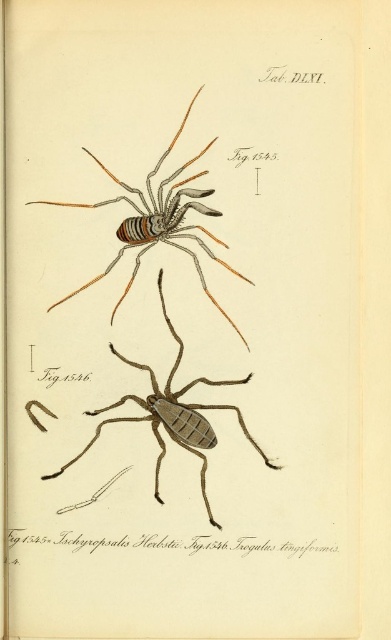
You are a researcher examining the illustration. You need to measure the distance between the matte striped spider at upper center and the edge of the page. The ruler you have is 3 feet long. Do you think you can measure this distance with your ruler?

The distance between the matte striped spider at upper center and the viewer is 3.82 feet. Since your ruler is only 3 feet long, you cannot measure the distance directly. You need a longer ruler or a different measuring method.

You are an entomologist examining the scientific illustration. You need to determine which spider is smaller between the matte striped spider at upper center and the brown matte spider at center. Which one is smaller?

The matte striped spider at upper center is shorter than the brown matte spider at center, so the matte striped spider at upper center is smaller.